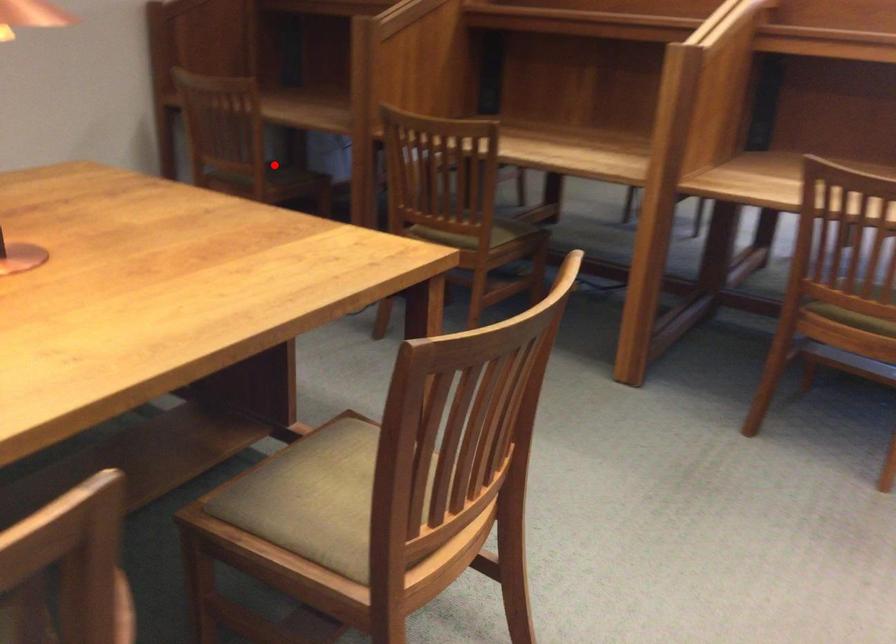
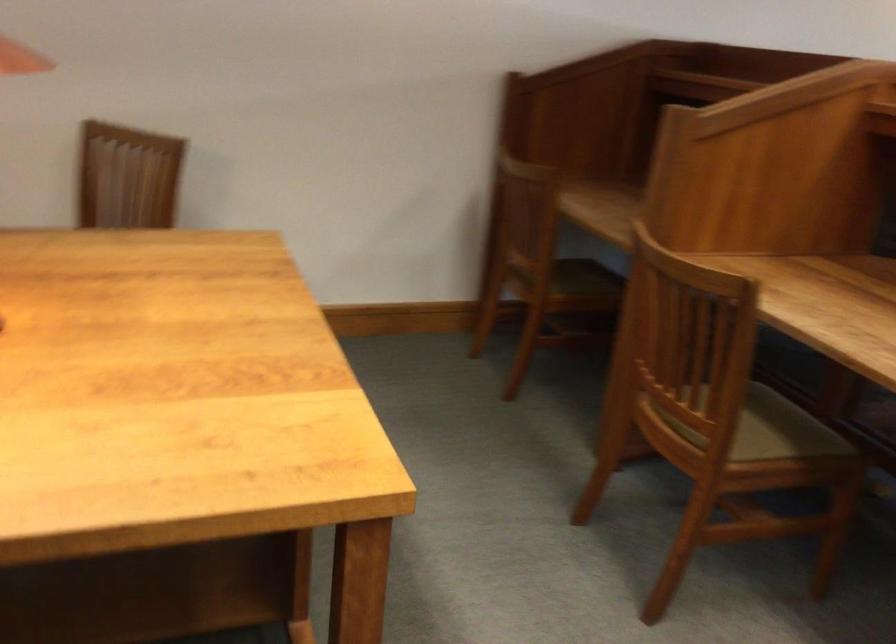
Question: I am providing you with two images of the same scene from different viewpoints. Image1 has a red point marked. In image2, the corresponding 3D location appears at what relative position? Reply with the corresponding letter.

Choices:
 (A) Closer
 (B) Farther

Answer: (A)